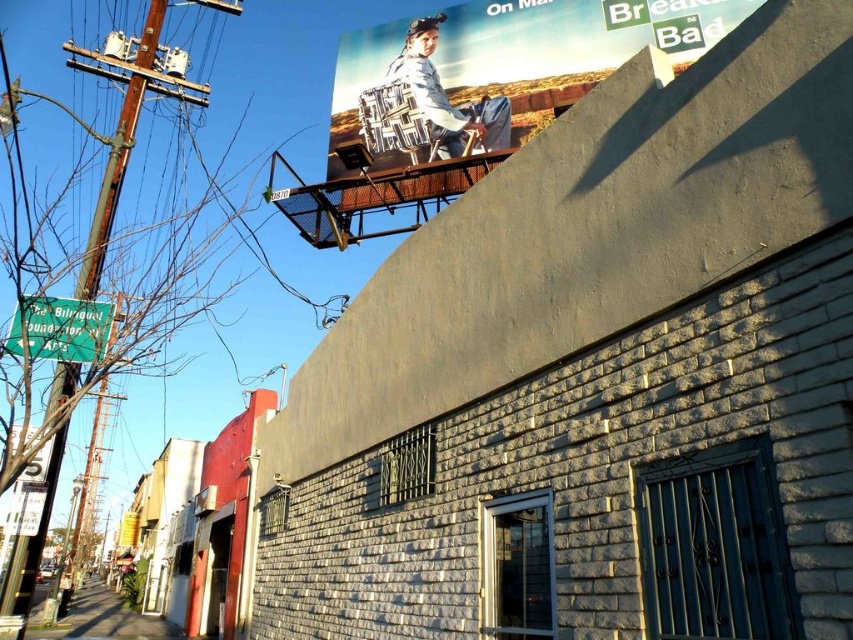
You are a photographer trying to capture a clear shot of both the matte plastic billboard at upper center and the matte white shirt at upper center. Since the billboard is taller than the shirt, which object will you need to adjust your camera angle to focus on first?

The matte plastic billboard at upper center is taller than the matte white shirt at upper center, so you will need to adjust your camera angle to focus on the billboard first because it occupies more vertical space and may require framing adjustments to ensure both objects are in the shot.